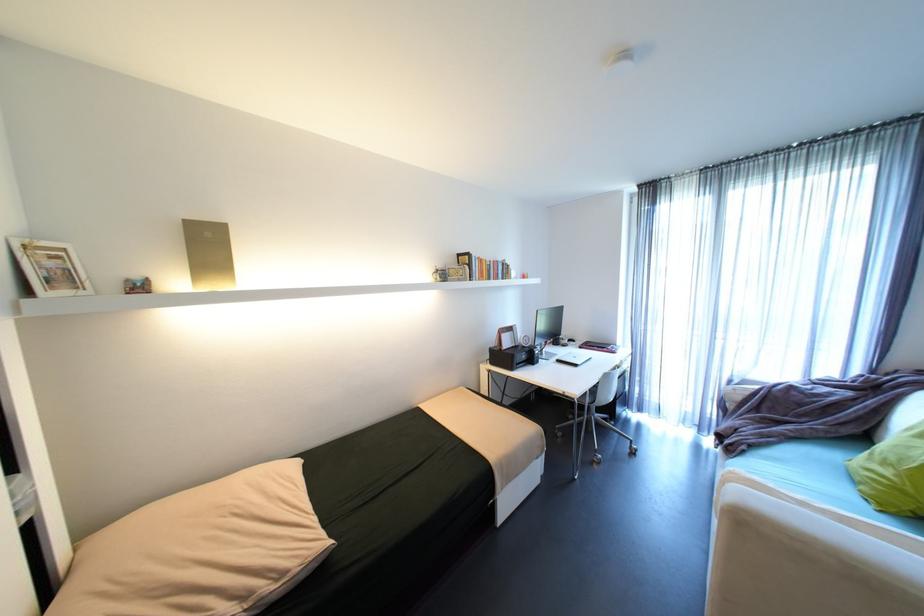
This screenshot has width=924, height=616. What do you see at coordinates (804, 564) in the screenshot?
I see `the white sofa armrest` at bounding box center [804, 564].